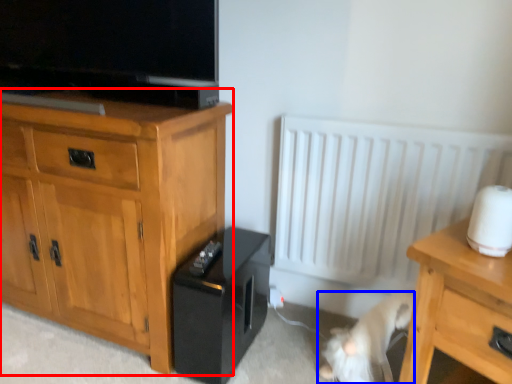
Question: Which object appears closest to the camera in this image, chest of drawers (highlighted by a red box) or animal (highlighted by a blue box)?

Choices:
 (A) chest of drawers
 (B) animal

Answer: (A)